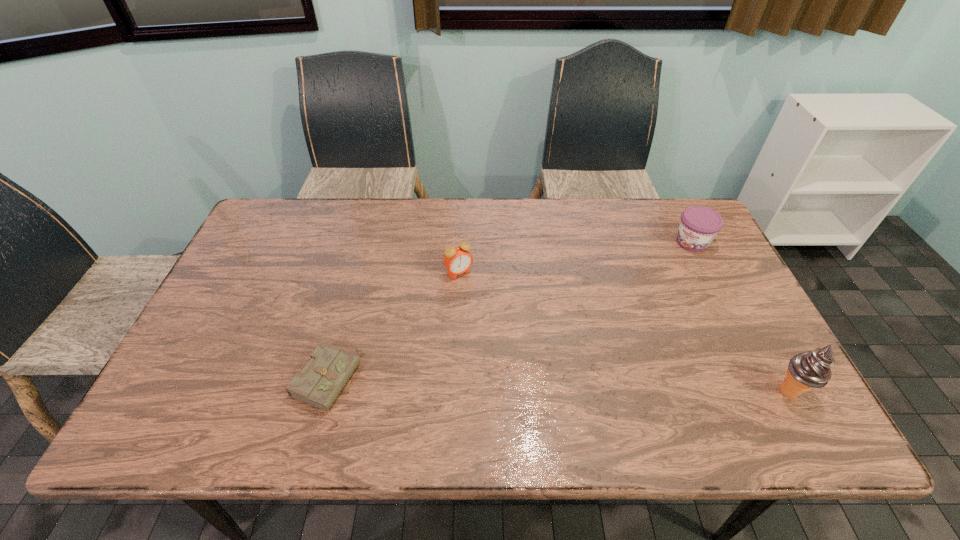
Find the location of `diary`. diary is located at coordinates (321, 381).

The width and height of the screenshot is (960, 540). I want to click on the leftmost object, so click(321, 381).

The height and width of the screenshot is (540, 960). Find the location of `icecream`. icecream is located at coordinates (807, 370).

The width and height of the screenshot is (960, 540). Identify the location of the third nearest object. (457, 260).

Identify the location of the third object from right to left. This screenshot has width=960, height=540. (457, 260).

Locate an element on the screen. the second shortest object is located at coordinates (699, 225).

Where is `jam`? This screenshot has height=540, width=960. jam is located at coordinates (699, 225).

At what (x,y) coordinates should I click in order to perform the action: click on free space located 0.390m on the right of the leftmost object. Please return your answer as a coordinate pair (x, y). Image resolution: width=960 pixels, height=540 pixels. Looking at the image, I should click on [524, 379].

Identify the location of free space located 0.090m on the left of the tallest object. Image resolution: width=960 pixels, height=540 pixels. (732, 391).

I want to click on blank area located on the face of the third object from right to left, so click(x=525, y=360).